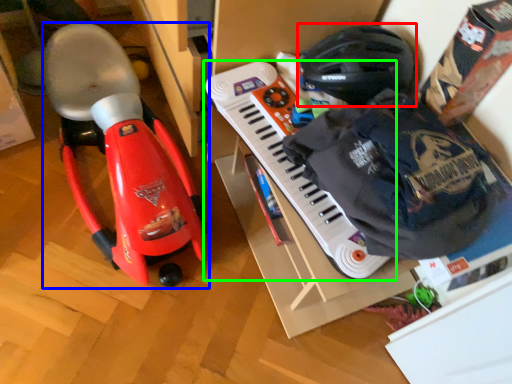
Question: Based on their relative distances, which object is nearer to helmet (highlighted by a red box)? Choose from toy (highlighted by a blue box) and musical keyboard (highlighted by a green box).

Choices:
 (A) toy
 (B) musical keyboard

Answer: (B)